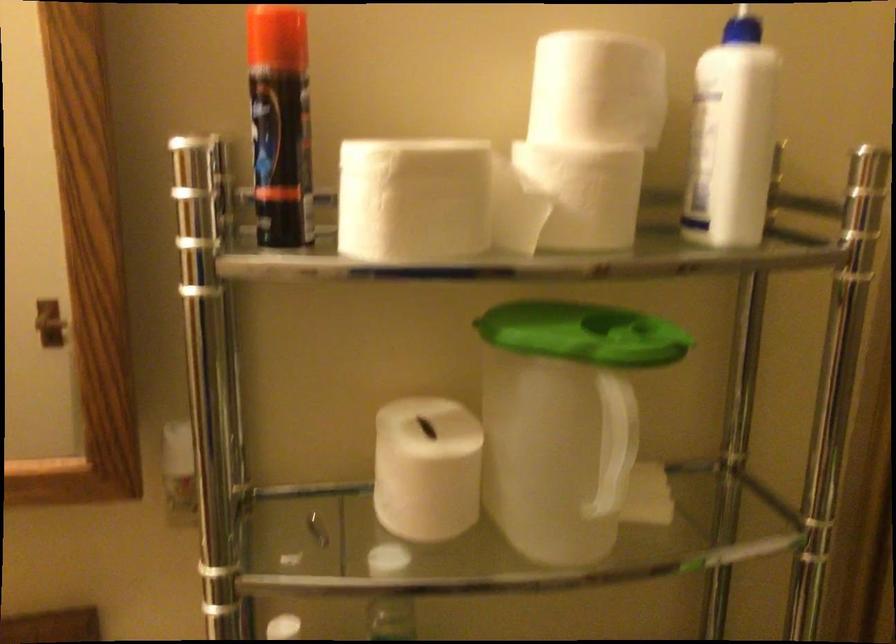
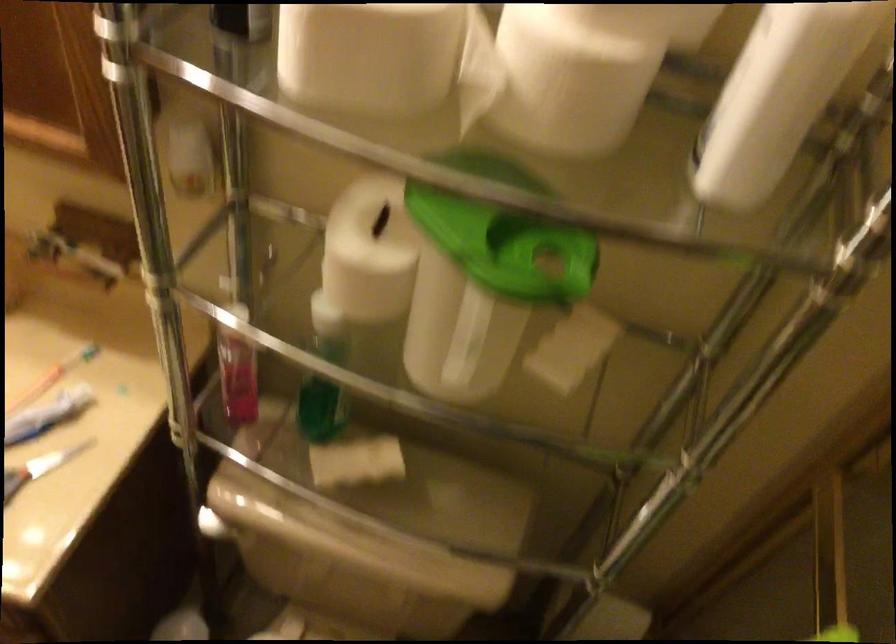
The point at (444, 207) is marked in the first image. Where is the corresponding point in the second image?

(368, 55)